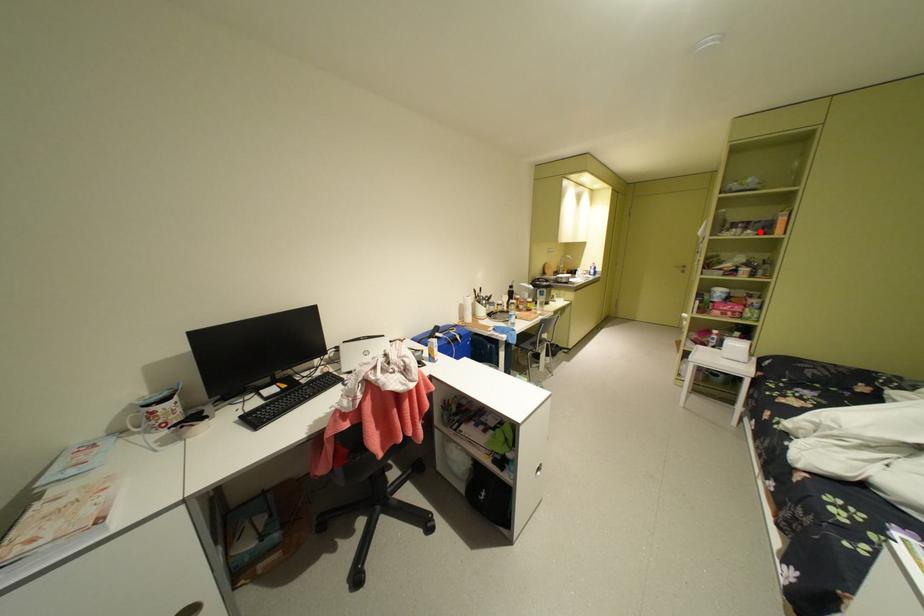
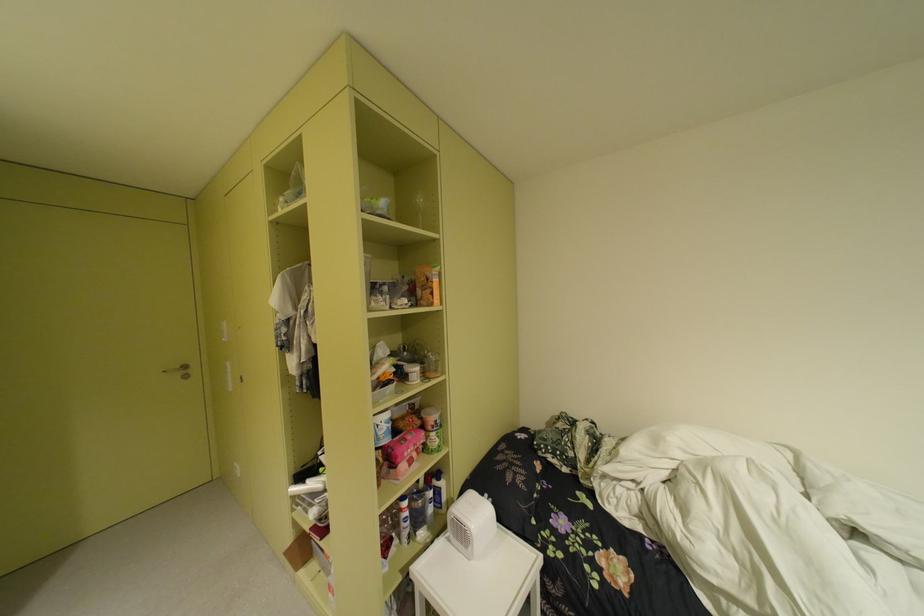
In the second image, find the point that corresponds to the highlighted location in the first image.

(417, 301)